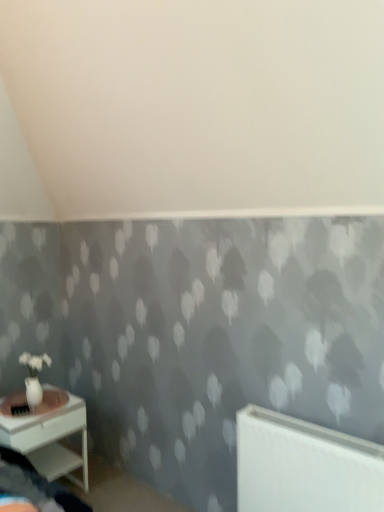
Identify the location of white glossy nightstand at lower left. The width and height of the screenshot is (384, 512). (48, 435).

Describe the element at coordinates (48, 435) in the screenshot. I see `white glossy nightstand at lower left` at that location.

Locate an element on the screen. This screenshot has width=384, height=512. white matte radiator at lower right is located at coordinates (304, 466).

The width and height of the screenshot is (384, 512). What do you see at coordinates (304, 466) in the screenshot?
I see `white matte radiator at lower right` at bounding box center [304, 466].

Where is `white glossy nightstand at lower left`? Image resolution: width=384 pixels, height=512 pixels. white glossy nightstand at lower left is located at coordinates [48, 435].

Is white glossy nightstand at lower left at the right side of white matte radiator at lower right?

Incorrect, white glossy nightstand at lower left is not on the right side of white matte radiator at lower right.

Considering their positions, is white glossy nightstand at lower left located in front of or behind white matte radiator at lower right?

Clearly, white glossy nightstand at lower left is behind white matte radiator at lower right.

Between point (6, 422) and point (249, 474), which one is positioned behind?

Point (6, 422)

From the image's perspective, does white glossy nightstand at lower left appear lower than white matte radiator at lower right?

Yes.

From a real-world perspective, which is physically above, white glossy nightstand at lower left or white matte radiator at lower right?

white matte radiator at lower right, from a real-world perspective.

Looking at their sizes, would you say white glossy nightstand at lower left is wider or thinner than white matte radiator at lower right?

white glossy nightstand at lower left is wider than white matte radiator at lower right.

In terms of height, does white glossy nightstand at lower left look taller or shorter compared to white matte radiator at lower right?

Considering their sizes, white glossy nightstand at lower left has more height than white matte radiator at lower right.

Considering the sizes of objects white glossy nightstand at lower left and white matte radiator at lower right in the image provided, who is bigger, white glossy nightstand at lower left or white matte radiator at lower right?

white glossy nightstand at lower left.

Is white glossy nightstand at lower left not inside white matte radiator at lower right?

That's correct, white glossy nightstand at lower left is outside of white matte radiator at lower right.

Is white glossy nightstand at lower left directly adjacent to white matte radiator at lower right?

white glossy nightstand at lower left is not next to white matte radiator at lower right, and they're not touching.

Is white glossy nightstand at lower left facing away from white matte radiator at lower right?

No.

How different are the orientations of white glossy nightstand at lower left and white matte radiator at lower right in degrees?

There is a 91.1-degree angle between the facing directions of white glossy nightstand at lower left and white matte radiator at lower right.

You are a GUI agent. You are given a task and a screenshot of the screen. Output one action in this format:
    pyautogui.click(x=<x>, y=<y>)
    Task: Click on the radiator above the white glossy nightstand at lower left (from the image's perspective)
    
    Given the screenshot: What is the action you would take?
    pyautogui.click(x=304, y=466)

Which object is positioned more to the left, white matte radiator at lower right or white glossy nightstand at lower left?

From the viewer's perspective, white glossy nightstand at lower left appears more on the left side.

Does white matte radiator at lower right come in front of white glossy nightstand at lower left?

Yes, it is in front of white glossy nightstand at lower left.

Is point (279, 413) farther from camera compared to point (45, 472)?

No, it is not.

From the image's perspective, which is above, white matte radiator at lower right or white glossy nightstand at lower left?

white matte radiator at lower right appears higher in the image.

From a real-world perspective, between white matte radiator at lower right and white glossy nightstand at lower left, who is vertically higher?

white matte radiator at lower right is physically above.

Considering the relative sizes of white matte radiator at lower right and white glossy nightstand at lower left in the image provided, is white matte radiator at lower right thinner than white glossy nightstand at lower left?

Yes.

Looking at this image, who is shorter, white matte radiator at lower right or white glossy nightstand at lower left?

white matte radiator at lower right.

Considering the relative sizes of white matte radiator at lower right and white glossy nightstand at lower left in the image provided, is white matte radiator at lower right bigger than white glossy nightstand at lower left?

No, white matte radiator at lower right is not bigger than white glossy nightstand at lower left.

Do you think white matte radiator at lower right is within white glossy nightstand at lower left, or outside of it?

white matte radiator at lower right is spatially situated outside white glossy nightstand at lower left.

Are white matte radiator at lower right and white glossy nightstand at lower left beside each other?

No, white matte radiator at lower right is not next to white glossy nightstand at lower left.

Consider the image. Is white matte radiator at lower right facing towards white glossy nightstand at lower left?

No.

In the scene shown: How many degrees apart are the facing directions of white matte radiator at lower right and white glossy nightstand at lower left?

91.1 degrees.

Where is `radiator above the white glossy nightstand at lower left (from the image's perspective)`? Image resolution: width=384 pixels, height=512 pixels. radiator above the white glossy nightstand at lower left (from the image's perspective) is located at coordinates (304, 466).

At what (x,y) coordinates should I click in order to perform the action: click on nightstand to the left of white matte radiator at lower right. Please return your answer as a coordinate pair (x, y). Looking at the image, I should click on (48, 435).

Find the location of a particular element. radiator that is on the right side of white glossy nightstand at lower left is located at coordinates (304, 466).